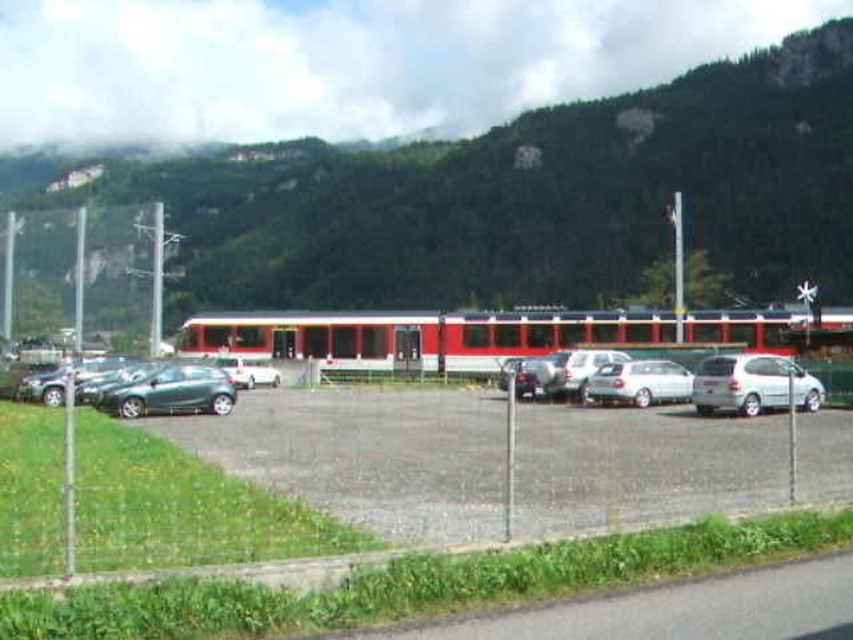
Based on the photo, you are a pedestrian standing at the edge of the parking lot near the chain link fence. You need to walk to the train platform. Which vehicle, the silver metallic minivan at right or the metallic silver sedan at center, will you pass closer to as you walk towards the platform?

The silver metallic minivan at right is positioned over the metallic silver sedan at center, so you will pass closer to the silver metallic minivan at right as you walk towards the platform.

You are a parking attendant trying to fit a delivery truck that is 2 meters wide into the parking lot. There are two cars in the way. The silver metallic minivan at right and the metallic silver sedan at center. Which car should you move to allow the delivery truck to pass through the space between them?

The silver metallic minivan at right might be wider than metallic silver sedan at center, so you should move the silver metallic minivan at right to allow the delivery truck to pass through the space between them.